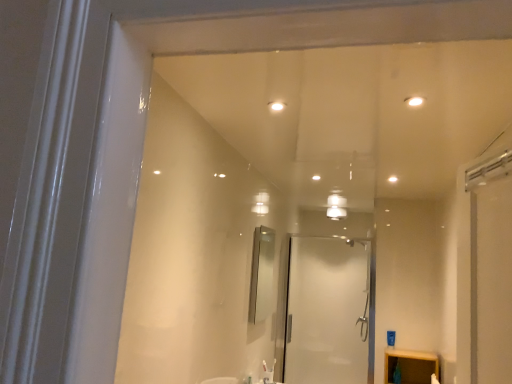
The image size is (512, 384). Describe the element at coordinates (326, 311) in the screenshot. I see `transparent glass shower door at center` at that location.

Where is `transparent glass shower door at center`? transparent glass shower door at center is located at coordinates (326, 311).

I want to click on silver metallic mirror at center, so click(261, 274).

What do you see at coordinates (261, 274) in the screenshot?
I see `silver metallic mirror at center` at bounding box center [261, 274].

What is the approximate width of silver metallic mirror at center?

7.17 centimeters.

This screenshot has height=384, width=512. Find the location of `transparent glass shower door at center`. transparent glass shower door at center is located at coordinates (326, 311).

Which object is positioned more to the left, silver metallic mirror at center or transparent glass shower door at center?

silver metallic mirror at center.

Is silver metallic mirror at center positioned in front of transparent glass shower door at center?

Yes, it is.

Is point (261, 310) in front of point (341, 247)?

Yes, point (261, 310) is in front of point (341, 247).

From the image's perspective, is silver metallic mirror at center above or below transparent glass shower door at center?

Based on their image positions, silver metallic mirror at center is located above transparent glass shower door at center.

From a real-world perspective, is silver metallic mirror at center below transparent glass shower door at center?

No, from a real-world perspective, silver metallic mirror at center is not beneath transparent glass shower door at center.

Can you confirm if silver metallic mirror at center is wider than transparent glass shower door at center?

No, silver metallic mirror at center is not wider than transparent glass shower door at center.

In terms of height, does silver metallic mirror at center look taller or shorter compared to transparent glass shower door at center?

In the image, silver metallic mirror at center appears to be shorter than transparent glass shower door at center.

Does silver metallic mirror at center have a smaller size compared to transparent glass shower door at center?

Correct, silver metallic mirror at center occupies less space than transparent glass shower door at center.

In the scene shown: Is silver metallic mirror at center completely or partially outside of transparent glass shower door at center?

Yes, silver metallic mirror at center is not within transparent glass shower door at center.

Is silver metallic mirror at center touching transparent glass shower door at center?

No.

Is silver metallic mirror at center positioned with its back to transparent glass shower door at center?

No, transparent glass shower door at center is not at the back of silver metallic mirror at center.

How many degrees apart are the facing directions of silver metallic mirror at center and transparent glass shower door at center?

There is a 90.8-degree angle between the facing directions of silver metallic mirror at center and transparent glass shower door at center.

Measure the distance between silver metallic mirror at center and transparent glass shower door at center.

silver metallic mirror at center is 4.45 feet away from transparent glass shower door at center.

Identify the location of screen door that is under the silver metallic mirror at center (from a real-world perspective). coord(326,311).

Which is more to the right, transparent glass shower door at center or silver metallic mirror at center?

From the viewer's perspective, transparent glass shower door at center appears more on the right side.

Between transparent glass shower door at center and silver metallic mirror at center, which one is positioned in front?

silver metallic mirror at center is more forward.

Which is nearer, (292, 286) or (269, 285)?

Point (269, 285)

From the image's perspective, is transparent glass shower door at center above or below silver metallic mirror at center?

From the image's perspective, transparent glass shower door at center appears below silver metallic mirror at center.

From a real-world perspective, is transparent glass shower door at center positioned above or below silver metallic mirror at center?

transparent glass shower door at center is below silver metallic mirror at center.

Considering the sizes of objects transparent glass shower door at center and silver metallic mirror at center in the image provided, who is thinner, transparent glass shower door at center or silver metallic mirror at center?

With smaller width is silver metallic mirror at center.

Considering the sizes of transparent glass shower door at center and silver metallic mirror at center in the image, is transparent glass shower door at center taller or shorter than silver metallic mirror at center?

Considering their sizes, transparent glass shower door at center has more height than silver metallic mirror at center.

Is transparent glass shower door at center bigger or smaller than silver metallic mirror at center?

transparent glass shower door at center is bigger than silver metallic mirror at center.

Choose the correct answer: Is transparent glass shower door at center inside silver metallic mirror at center or outside it?

transparent glass shower door at center exists outside the volume of silver metallic mirror at center.

Is transparent glass shower door at center directly adjacent to silver metallic mirror at center?

There is a gap between transparent glass shower door at center and silver metallic mirror at center.

In the scene shown: Is transparent glass shower door at center oriented away from silver metallic mirror at center?

No, silver metallic mirror at center is not at the back of transparent glass shower door at center.

How different are the orientations of transparent glass shower door at center and silver metallic mirror at center in degrees?

90.8 degrees separate the facing orientations of transparent glass shower door at center and silver metallic mirror at center.

Image resolution: width=512 pixels, height=384 pixels. Identify the location of screen door below the silver metallic mirror at center (from a real-world perspective). (326, 311).

Find the location of a particular element. Image resolution: width=512 pixels, height=384 pixels. mirror located in front of the transparent glass shower door at center is located at coordinates (261, 274).

Where is `mirror that appears on the left of transparent glass shower door at center`? The width and height of the screenshot is (512, 384). mirror that appears on the left of transparent glass shower door at center is located at coordinates (261, 274).